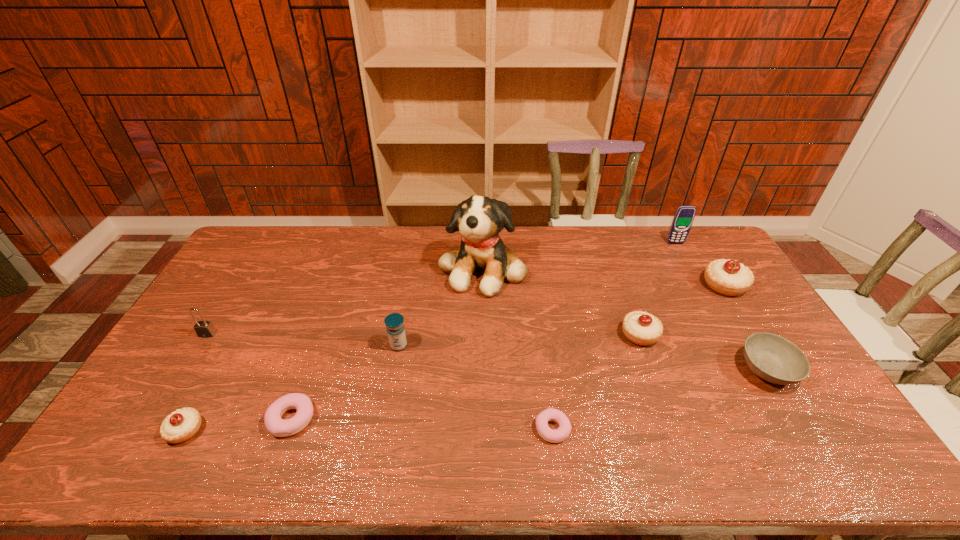
Locate an element on the screen. vacant area between the shortest pastry and the second tallest object is located at coordinates (614, 336).

In order to click on vacant area that lies between the bowl and the farthest beige pastry in this screenshot , I will do `click(746, 328)`.

Where is `vacant point located between the shortest pastry and the ninth object from right to left`? The width and height of the screenshot is (960, 540). vacant point located between the shortest pastry and the ninth object from right to left is located at coordinates (369, 429).

Find the location of a particular element. The image size is (960, 540). free space between the gray padlock and the rightmost beige pastry is located at coordinates (466, 309).

Identify the location of unoccupied area between the medicine and the leftmost object. This screenshot has width=960, height=540. (303, 340).

You are a GUI agent. You are given a task and a screenshot of the screen. Output one action in this format:
    pyautogui.click(x=<x>, y=<y>)
    Task: Click on the vacant area between the smaller pink pastry and the bowl
    This screenshot has height=540, width=960.
    Given the screenshot: What is the action you would take?
    pyautogui.click(x=660, y=399)

Where is `empty space that is in between the fifth shortest object and the leftmost object`? Image resolution: width=960 pixels, height=540 pixels. empty space that is in between the fifth shortest object and the leftmost object is located at coordinates (423, 334).

You are a GUI agent. You are given a task and a screenshot of the screen. Output one action in this format:
    pyautogui.click(x=<x>, y=<y>)
    Task: Click on the empty space between the nearest beige pastry and the tallest object
    This screenshot has width=960, height=540.
    Given the screenshot: What is the action you would take?
    pyautogui.click(x=334, y=349)

Select which object is the seventh closest to the sixth tallest object. Please provide its 2D coordinates. Your answer should be formatted as a tuple, i.e. [(x, y)], where the tuple contains the x and y coordinates of a point satisfying the conditions above.

[(278, 427)]

I want to click on object that is the third closest one to the smallest beige pastry, so click(394, 322).